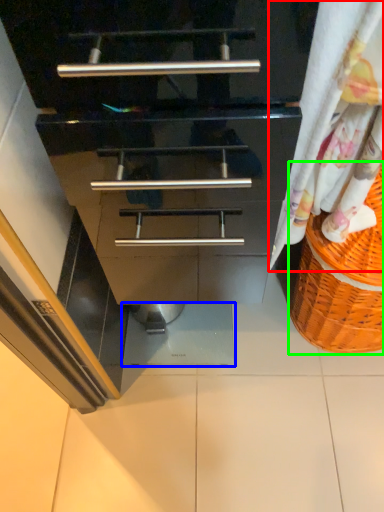
Question: Which object is positioned closest to curtain (highlighted by a red box)? Select from tile (highlighted by a blue box) and basket (highlighted by a green box).

Choices:
 (A) tile
 (B) basket

Answer: (B)